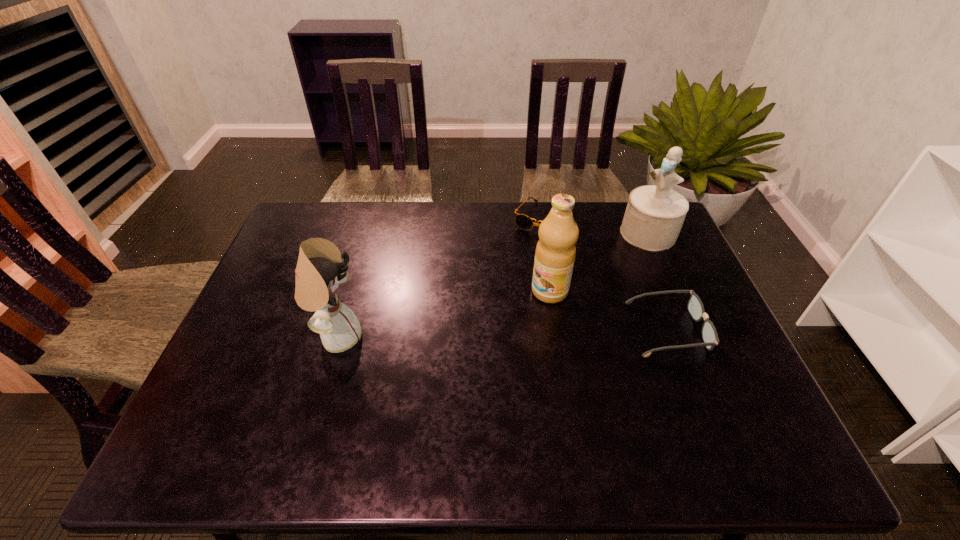
Identify the location of doll. The height and width of the screenshot is (540, 960). (319, 270).

Find the location of `spectacles`. spectacles is located at coordinates (695, 306).

Identify the location of olive oil. (555, 253).

Where is `sunglasses`? Image resolution: width=960 pixels, height=540 pixels. sunglasses is located at coordinates coord(524,222).

This screenshot has height=540, width=960. What are the coordinates of `figurine` in the screenshot? It's located at (654, 215).

Image resolution: width=960 pixels, height=540 pixels. Find the location of `vacant space located at the front face of the doll`. vacant space located at the front face of the doll is located at coordinates (382, 337).

The image size is (960, 540). I want to click on vacant space located 0.050m on the face of the spectacles, so click(x=720, y=329).

This screenshot has height=540, width=960. In order to click on vacant space situated on the label of the olive oil in this screenshot , I will do `click(426, 368)`.

Locate an element on the screen. vacant space located on the label of the olive oil is located at coordinates (433, 364).

Where is `free space located on the label of the olive oil`? free space located on the label of the olive oil is located at coordinates (446, 356).